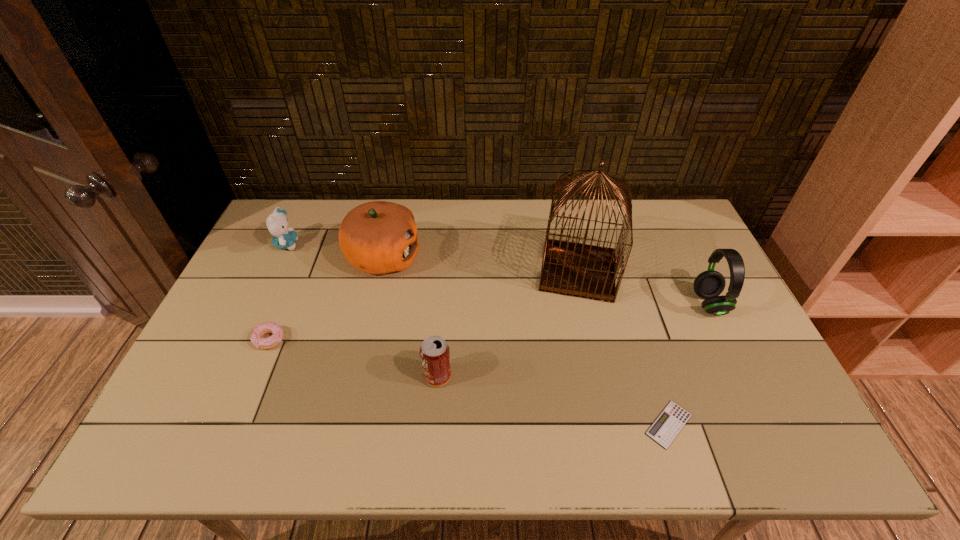
The height and width of the screenshot is (540, 960). What are the coordinates of `the tallest object` in the screenshot? It's located at (586, 271).

The height and width of the screenshot is (540, 960). What are the coordinates of `pumpkin` in the screenshot? It's located at (378, 237).

You are a GUI agent. You are given a task and a screenshot of the screen. Output one action in this format:
    pyautogui.click(x=<x>, y=<y>)
    Task: Click on the rightmost object
    
    Given the screenshot: What is the action you would take?
    pyautogui.click(x=709, y=284)

At what (x,y) coordinates should I click in order to perform the action: click on kitten. Please return your answer as a coordinate pair (x, y). Image resolution: width=960 pixels, height=540 pixels. Looking at the image, I should click on (277, 223).

Image resolution: width=960 pixels, height=540 pixels. What are the coordinates of `soda can` in the screenshot? It's located at (434, 352).

Image resolution: width=960 pixels, height=540 pixels. Find the location of `the fourth object from right to left`. the fourth object from right to left is located at coordinates (434, 352).

I want to click on doughnut, so click(x=256, y=338).

Image resolution: width=960 pixels, height=540 pixels. Identify the location of the fifth farthest object. click(x=256, y=338).

Where is `the nearest object`? The width and height of the screenshot is (960, 540). the nearest object is located at coordinates (666, 427).

Image resolution: width=960 pixels, height=540 pixels. I want to click on the shortest object, so click(666, 427).